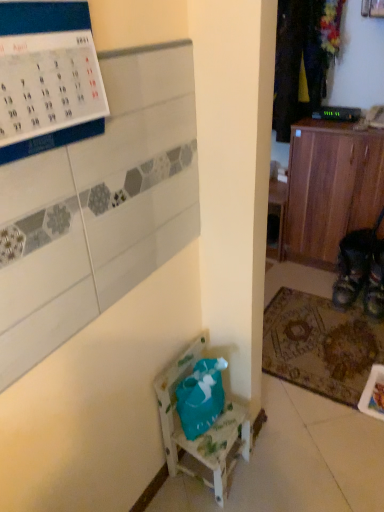
Image resolution: width=384 pixels, height=512 pixels. What do you see at coordinates (204, 433) in the screenshot? I see `wooden chair at lower center` at bounding box center [204, 433].

This screenshot has width=384, height=512. Identify the location of wooden chair at lower center. (204, 433).

Identify the location of wooden chair at lower center. (204, 433).